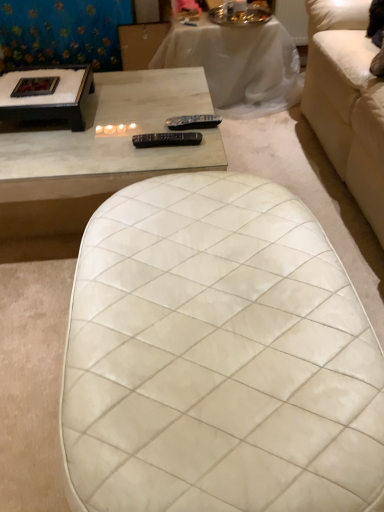
Locate an element on the screen. This screenshot has width=384, height=512. free space that is in between black plastic remote at center, the 2th remote viewed from the top, and black wood coffee table at upper left, which ranks as the second coffee table in right-to-left order is located at coordinates (113, 130).